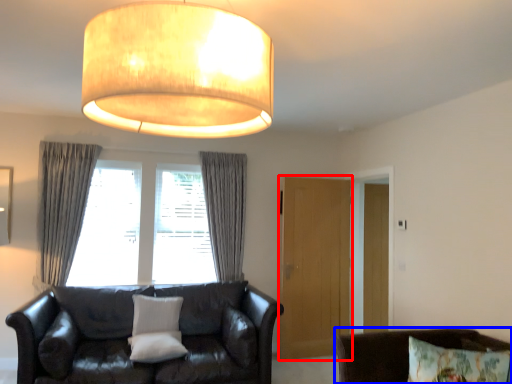
Question: Which object is closer to the camera taking this photo, glass door (highlighted by a red box) or chair (highlighted by a blue box)?

Choices:
 (A) glass door
 (B) chair

Answer: (B)